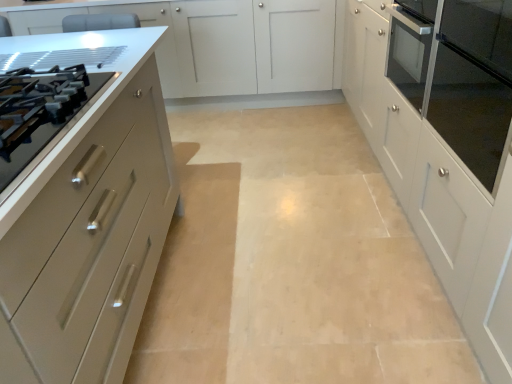
Question: Can you confirm if satin silver drawer at left is positioned to the left of matte beige cabinet at left, acting as the third cabinetry starting from the right?

Choices:
 (A) yes
 (B) no

Answer: (B)

Question: Is satin silver drawer at left bigger than matte beige cabinet at left, acting as the first cabinetry starting from the left?

Choices:
 (A) no
 (B) yes

Answer: (A)

Question: Is satin silver drawer at left thinner than matte beige cabinet at left, acting as the third cabinetry starting from the right?

Choices:
 (A) yes
 (B) no

Answer: (A)

Question: Is satin silver drawer at left positioned far away from matte beige cabinet at left, acting as the first cabinetry starting from the left?

Choices:
 (A) yes
 (B) no

Answer: (B)

Question: Is satin silver drawer at left next to matte beige cabinet at left, acting as the third cabinetry starting from the right?

Choices:
 (A) yes
 (B) no

Answer: (B)

Question: Does satin silver drawer at left contain matte beige cabinet at left, acting as the first cabinetry starting from the left?

Choices:
 (A) yes
 (B) no

Answer: (B)

Question: Considering the relative sizes of white glossy cabinet at right, the 1th cabinetry when ordered from right to left, and matte white cabinet at center, which is the second cabinetry from right to left, in the image provided, is white glossy cabinet at right, the 1th cabinetry when ordered from right to left, taller than matte white cabinet at center, which is the second cabinetry from right to left,?

Choices:
 (A) no
 (B) yes

Answer: (B)

Question: Considering the relative sizes of white glossy cabinet at right, the 1th cabinetry when ordered from right to left, and matte white cabinet at center, the second cabinetry positioned from the left, in the image provided, is white glossy cabinet at right, the 1th cabinetry when ordered from right to left, smaller than matte white cabinet at center, the second cabinetry positioned from the left,?

Choices:
 (A) yes
 (B) no

Answer: (B)

Question: Does white glossy cabinet at right, placed as the third cabinetry when sorted from left to right, have a larger size compared to matte white cabinet at center, the second cabinetry positioned from the left?

Choices:
 (A) no
 (B) yes

Answer: (B)

Question: Considering the relative positions of white glossy cabinet at right, the 1th cabinetry when ordered from right to left, and matte white cabinet at center, which is the second cabinetry from right to left, in the image provided, is white glossy cabinet at right, the 1th cabinetry when ordered from right to left, behind matte white cabinet at center, which is the second cabinetry from right to left,?

Choices:
 (A) yes
 (B) no

Answer: (B)

Question: Is white glossy cabinet at right, the 1th cabinetry when ordered from right to left, facing towards matte white cabinet at center, the second cabinetry positioned from the left?

Choices:
 (A) no
 (B) yes

Answer: (A)

Question: From a real-world perspective, is white glossy cabinet at right, placed as the third cabinetry when sorted from left to right, positioned under matte white cabinet at center, which is the second cabinetry from right to left, based on gravity?

Choices:
 (A) yes
 (B) no

Answer: (B)

Question: Is matte beige cabinet at left, acting as the first cabinetry starting from the left, taller than satin silver drawer at left?

Choices:
 (A) no
 (B) yes

Answer: (B)